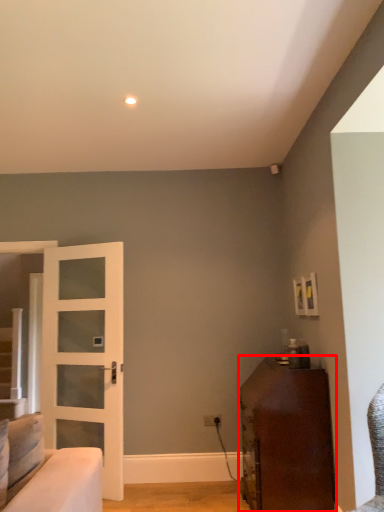
Question: From the image's perspective, considering the relative positions of furniture (annotated by the red box) and door in the image provided, where is furniture (annotated by the red box) located with respect to the staircase?

Choices:
 (A) above
 (B) below

Answer: (B)